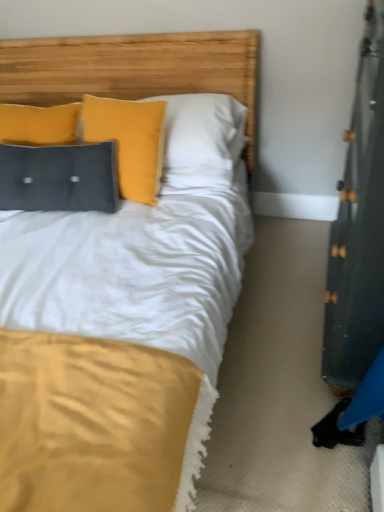
Question: Is velvet-like dark gray pillow at upper left taller than wooden headboard at upper center?

Choices:
 (A) yes
 (B) no

Answer: (B)

Question: Is velvet-like dark gray pillow at upper left closer to the viewer compared to wooden headboard at upper center?

Choices:
 (A) yes
 (B) no

Answer: (B)

Question: From the image's perspective, is velvet-like dark gray pillow at upper left over wooden headboard at upper center?

Choices:
 (A) yes
 (B) no

Answer: (B)

Question: Is wooden headboard at upper center a part of velvet-like dark gray pillow at upper left?

Choices:
 (A) no
 (B) yes

Answer: (A)

Question: Is velvet-like dark gray pillow at upper left wider than wooden headboard at upper center?

Choices:
 (A) no
 (B) yes

Answer: (A)

Question: Is velvet-like dark gray pillow at upper left at the right side of wooden headboard at upper center?

Choices:
 (A) no
 (B) yes

Answer: (A)

Question: Is wooden headboard at upper center smaller than velvet-like dark gray pillow at upper left?

Choices:
 (A) no
 (B) yes

Answer: (A)

Question: Can velvet-like dark gray pillow at upper left be found inside wooden headboard at upper center?

Choices:
 (A) no
 (B) yes

Answer: (A)

Question: Considering the relative sizes of wooden headboard at upper center and velvet-like dark gray pillow at upper left in the image provided, is wooden headboard at upper center wider than velvet-like dark gray pillow at upper left?

Choices:
 (A) no
 (B) yes

Answer: (B)

Question: From the image's perspective, does wooden headboard at upper center appear higher than velvet-like dark gray pillow at upper left?

Choices:
 (A) yes
 (B) no

Answer: (A)

Question: Is wooden headboard at upper center oriented away from velvet-like dark gray pillow at upper left?

Choices:
 (A) no
 (B) yes

Answer: (A)

Question: Does wooden headboard at upper center touch velvet-like dark gray pillow at upper left?

Choices:
 (A) no
 (B) yes

Answer: (A)

Question: Relative to wooden headboard at upper center, is velvet-like dark gray pillow at upper left in front or behind?

Choices:
 (A) behind
 (B) front

Answer: (A)